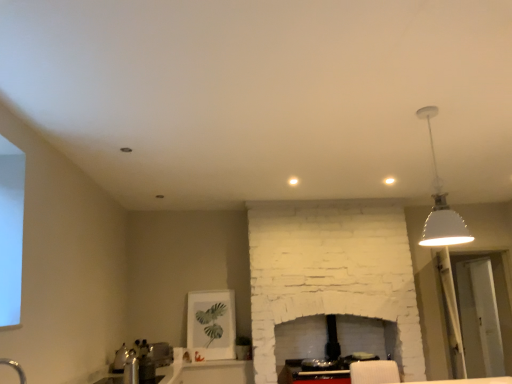
Question: From a real-world perspective, is silver metallic faucet at lower left on top of satin silver toaster at lower left?

Choices:
 (A) yes
 (B) no

Answer: (A)

Question: Does silver metallic faucet at lower left turn towards satin silver toaster at lower left?

Choices:
 (A) yes
 (B) no

Answer: (B)

Question: Are silver metallic faucet at lower left and satin silver toaster at lower left located far from each other?

Choices:
 (A) yes
 (B) no

Answer: (B)

Question: Is silver metallic faucet at lower left positioned before satin silver toaster at lower left?

Choices:
 (A) no
 (B) yes

Answer: (B)

Question: Is satin silver toaster at lower left at the back of silver metallic faucet at lower left?

Choices:
 (A) no
 (B) yes

Answer: (A)

Question: Is silver metallic faucet at lower left at the left side of satin silver toaster at lower left?

Choices:
 (A) yes
 (B) no

Answer: (B)

Question: From the image's perspective, is silver metallic faucet at lower left beneath transparent glass door at right?

Choices:
 (A) yes
 (B) no

Answer: (B)

Question: Is silver metallic faucet at lower left positioned far away from transparent glass door at right?

Choices:
 (A) yes
 (B) no

Answer: (A)

Question: From a real-world perspective, is silver metallic faucet at lower left over transparent glass door at right?

Choices:
 (A) no
 (B) yes

Answer: (A)

Question: Is silver metallic faucet at lower left further to camera compared to transparent glass door at right?

Choices:
 (A) no
 (B) yes

Answer: (A)

Question: Is silver metallic faucet at lower left thinner than transparent glass door at right?

Choices:
 (A) no
 (B) yes

Answer: (B)

Question: Considering the relative sizes of silver metallic faucet at lower left and transparent glass door at right in the image provided, is silver metallic faucet at lower left bigger than transparent glass door at right?

Choices:
 (A) no
 (B) yes

Answer: (A)

Question: Is silver metallic faucet at lower left touching white matte lampshade at upper right?

Choices:
 (A) no
 (B) yes

Answer: (A)